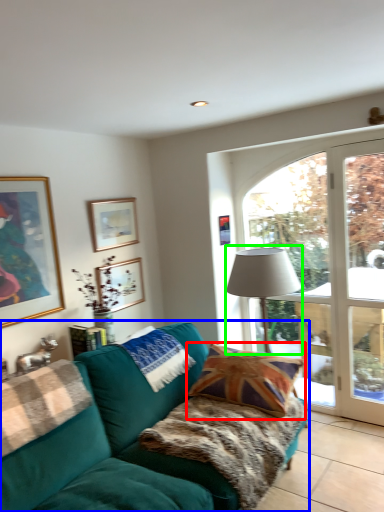
Question: Which object is positioned farthest from pillow (highlighted by a red box)? Select from studio couch (highlighted by a blue box) and table lamp (highlighted by a green box).

Choices:
 (A) studio couch
 (B) table lamp

Answer: (B)